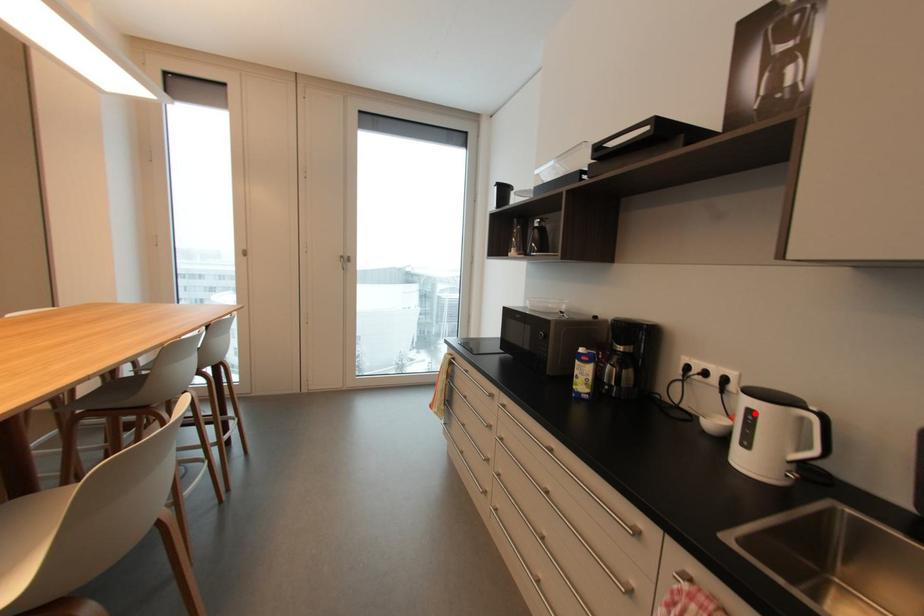
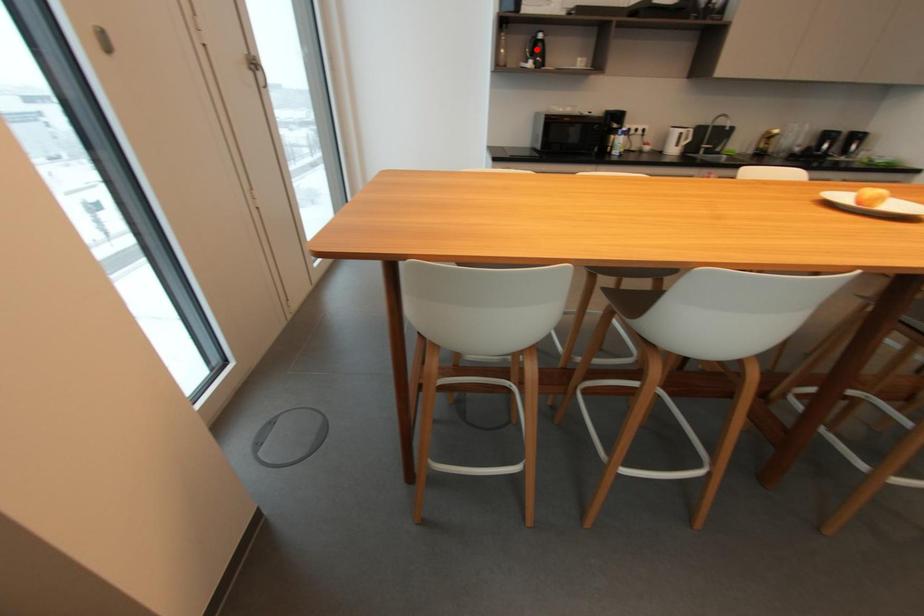
I am providing you with two images of the same scene from different viewpoints. A red point is marked on the first image and another point is marked on the second image. Do the highlighted points in image1 and image2 indicate the same real-world spot?

No